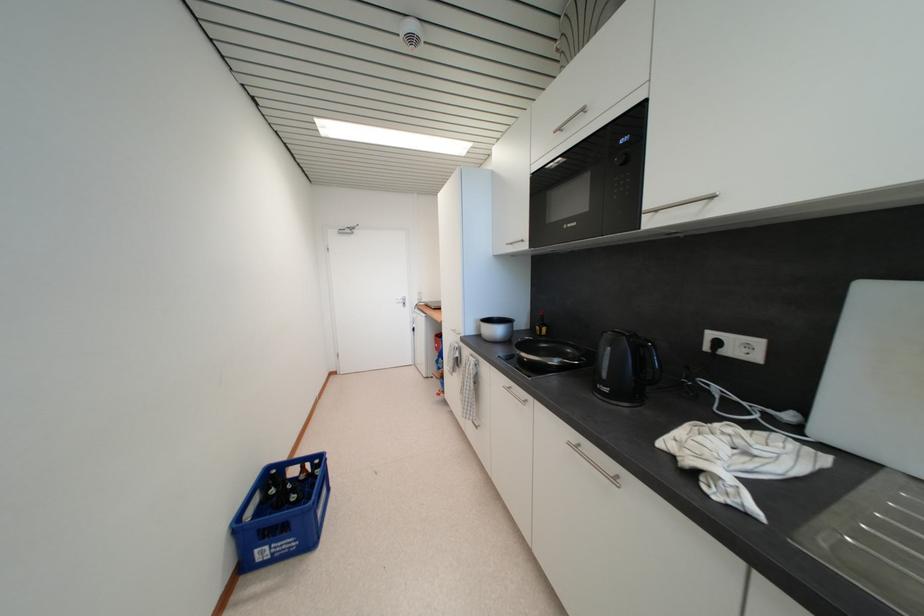
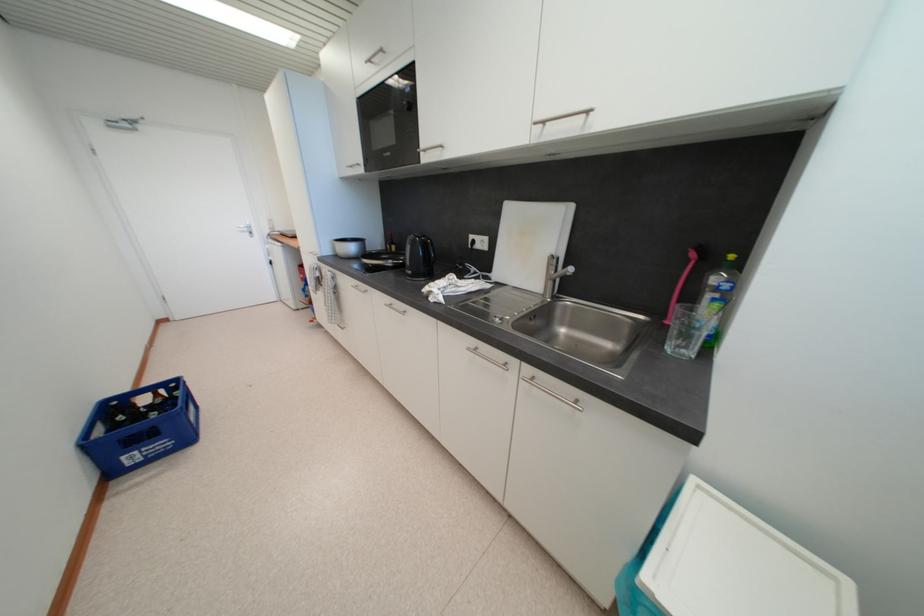
Where in the second image is the point corresponding to point (504, 333) from the first image?

(357, 251)